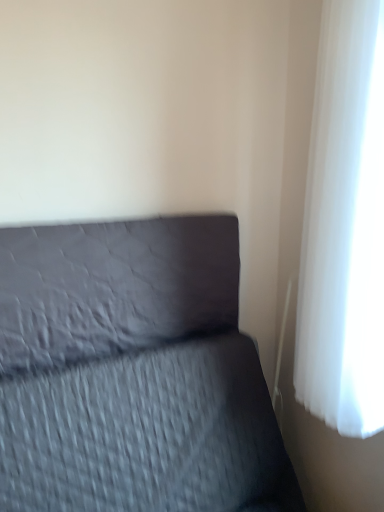
What do you see at coordinates (133, 372) in the screenshot? The image size is (384, 512). I see `textured gray bed at lower left` at bounding box center [133, 372].

Where is `white sheer curtain at right`? Image resolution: width=384 pixels, height=512 pixels. white sheer curtain at right is located at coordinates (345, 226).

Is matte gray pillow at center surrounding textured gray bed at lower left?

That's incorrect, textured gray bed at lower left is not inside matte gray pillow at center.

From a real-world perspective, who is located higher, matte gray pillow at center or textured gray bed at lower left?

In real-world perspective, matte gray pillow at center is above.

Would you consider matte gray pillow at center to be distant from textured gray bed at lower left?

No, there isn't a large distance between matte gray pillow at center and textured gray bed at lower left.

From the image's perspective, which one is positioned higher, matte gray pillow at center or textured gray bed at lower left?

matte gray pillow at center, from the image's perspective.

Locate an element on the screen. The height and width of the screenshot is (512, 384). furniture on the left of the white sheer curtain at right is located at coordinates (133, 372).

From the image's perspective, would you say white sheer curtain at right is positioned over textured gray bed at lower left?

Yes.

What's the angular difference between white sheer curtain at right and textured gray bed at lower left's facing directions?

88.9 degrees separate the facing orientations of white sheer curtain at right and textured gray bed at lower left.

Can you confirm if textured gray bed at lower left is smaller than white sheer curtain at right?

Incorrect, textured gray bed at lower left is not smaller in size than white sheer curtain at right.

Which object is further away from the camera, textured gray bed at lower left or white sheer curtain at right?

white sheer curtain at right is further from the camera.

Is textured gray bed at lower left aimed at white sheer curtain at right?

No.

Can you confirm if white sheer curtain at right is taller than matte gray pillow at center?

Indeed, white sheer curtain at right has a greater height compared to matte gray pillow at center.

Is white sheer curtain at right oriented towards matte gray pillow at center?

No, white sheer curtain at right does not turn towards matte gray pillow at center.

Based on their sizes in the image, would you say white sheer curtain at right is bigger or smaller than matte gray pillow at center?

A: In the image, white sheer curtain at right appears to be larger than matte gray pillow at center.

Relative to matte gray pillow at center, is white sheer curtain at right in front or behind?

white sheer curtain at right is positioned closer to the viewer than matte gray pillow at center.

Which object is closer to the camera, textured gray bed at lower left or matte gray pillow at center?

textured gray bed at lower left is closer to the camera.

Is textured gray bed at lower left not within matte gray pillow at center?

Yes, textured gray bed at lower left is located beyond the bounds of matte gray pillow at center.

From the image's perspective, is textured gray bed at lower left positioned above or below matte gray pillow at center?

Based on their image positions, textured gray bed at lower left is located beneath matte gray pillow at center.

Is textured gray bed at lower left oriented away from matte gray pillow at center?

No, textured gray bed at lower left is not facing the opposite direction of matte gray pillow at center.

Looking at this image, is matte gray pillow at center bigger than white sheer curtain at right?

No, matte gray pillow at center is not bigger than white sheer curtain at right.

Looking at this image, is matte gray pillow at center in contact with white sheer curtain at right?

No, matte gray pillow at center is not beside white sheer curtain at right.

Is matte gray pillow at center taller than white sheer curtain at right?

No.

Is matte gray pillow at center completely or partially outside of white sheer curtain at right?

Indeed, matte gray pillow at center is completely outside white sheer curtain at right.

Locate an element on the screen. The width and height of the screenshot is (384, 512). furniture below the matte gray pillow at center (from the image's perspective) is located at coordinates (133, 372).

I want to click on curtain that is behind the textured gray bed at lower left, so click(x=345, y=226).

Looking at the image, which one is located further to textured gray bed at lower left, matte gray pillow at center or white sheer curtain at right?

white sheer curtain at right is positioned further to the anchor textured gray bed at lower left.

Estimate the real-world distances between objects in this image. Which object is further from white sheer curtain at right, matte gray pillow at center or textured gray bed at lower left?

The object further to white sheer curtain at right is matte gray pillow at center.

Considering their positions, is textured gray bed at lower left positioned further to matte gray pillow at center than white sheer curtain at right?

white sheer curtain at right is positioned further to the anchor matte gray pillow at center.

Which object lies nearer to the anchor point white sheer curtain at right, textured gray bed at lower left or matte gray pillow at center?

Based on the image, textured gray bed at lower left appears to be nearer to white sheer curtain at right.

When comparing their distances from textured gray bed at lower left, does white sheer curtain at right or matte gray pillow at center seem further?

white sheer curtain at right is positioned further to the anchor textured gray bed at lower left.

Considering their positions, is white sheer curtain at right positioned closer to matte gray pillow at center than textured gray bed at lower left?

textured gray bed at lower left lies closer to matte gray pillow at center than the other object.

This screenshot has height=512, width=384. Find the location of `pillow between white sheer curtain at right and textured gray bed at lower left in the up-down direction`. pillow between white sheer curtain at right and textured gray bed at lower left in the up-down direction is located at coordinates (113, 287).